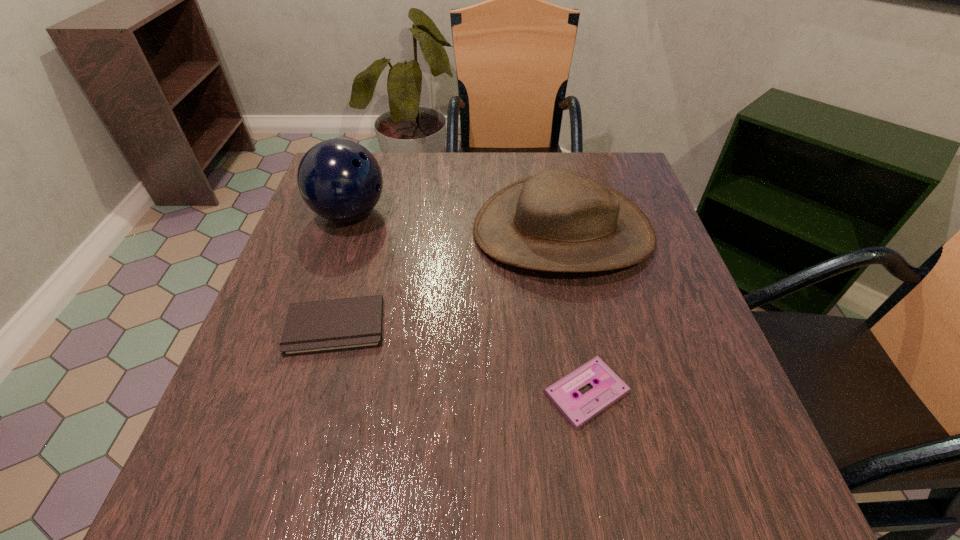
Image resolution: width=960 pixels, height=540 pixels. I want to click on unoccupied area between the third farthest object and the tallest object, so click(343, 270).

The height and width of the screenshot is (540, 960). I want to click on free space between the tallest object and the second nearest object, so click(343, 270).

The width and height of the screenshot is (960, 540). Identify the location of empty space between the tallest object and the nearest object. (468, 303).

You are a GUI agent. You are given a task and a screenshot of the screen. Output one action in this format:
    pyautogui.click(x=<x>, y=<y>)
    Task: Click on the object that is the second closest one to the nearest object
    The height and width of the screenshot is (540, 960).
    Given the screenshot: What is the action you would take?
    pyautogui.click(x=322, y=326)

Find the location of `object that stands as the closest to the videotape`. object that stands as the closest to the videotape is located at coordinates (558, 220).

Where is `free space that satisfies the following two spatial constraints: 1. on the back side of the cowboy hat; 2. on the right side of the second shortest object`? The height and width of the screenshot is (540, 960). free space that satisfies the following two spatial constraints: 1. on the back side of the cowboy hat; 2. on the right side of the second shortest object is located at coordinates (362, 232).

The width and height of the screenshot is (960, 540). I want to click on free space that satisfies the following two spatial constraints: 1. on the back side of the cowboy hat; 2. on the surface of the tallest object near the finger holes, so click(x=560, y=214).

At what (x,y) coordinates should I click in order to perform the action: click on vacant region that satisfies the following two spatial constraints: 1. on the surface of the second shortest object near the finger holes; 2. on the left side of the tallest object. Please return your answer as a coordinate pair (x, y). This screenshot has height=540, width=960. Looking at the image, I should click on (312, 326).

Where is `free space in the image that satisfies the following two spatial constraints: 1. on the surface of the bowling ball near the finger holes; 2. on the right side of the videotape`? The image size is (960, 540). free space in the image that satisfies the following two spatial constraints: 1. on the surface of the bowling ball near the finger holes; 2. on the right side of the videotape is located at coordinates (291, 393).

You are a GUI agent. You are given a task and a screenshot of the screen. Output one action in this format:
    pyautogui.click(x=<x>, y=<y>)
    Task: Click on the free space that satisfies the following two spatial constraints: 1. on the surface of the shortest object near the finger holes; 2. on the right side of the tallest object
    This screenshot has height=540, width=960.
    Given the screenshot: What is the action you would take?
    pyautogui.click(x=291, y=393)